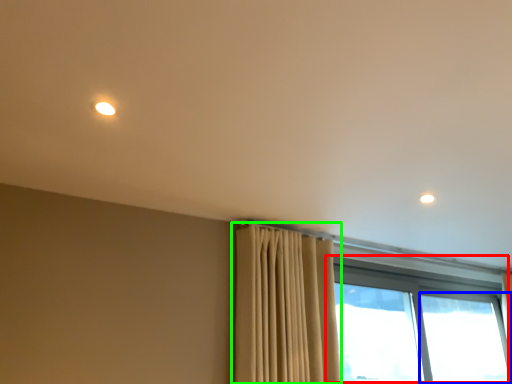
Question: Which is nearer to the window (highlighted by a red box)? window (highlighted by a blue box) or curtain (highlighted by a green box).

Choices:
 (A) window
 (B) curtain

Answer: (A)